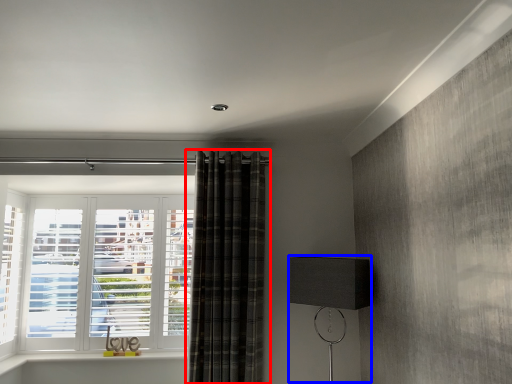
Question: Which point is further to the camera, curtain (highlighted by a red box) or table lamp (highlighted by a blue box)?

Choices:
 (A) curtain
 (B) table lamp

Answer: (A)